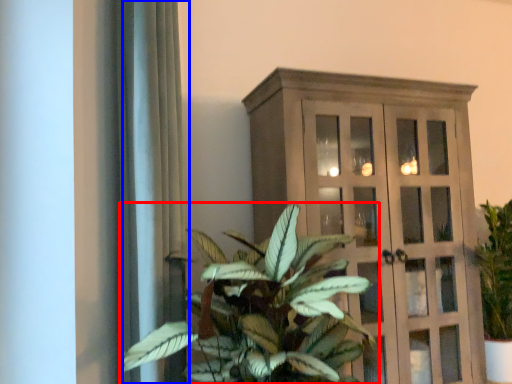
Question: Which point is further to the camera, houseplant (highlighted by a red box) or curtain (highlighted by a blue box)?

Choices:
 (A) houseplant
 (B) curtain

Answer: (B)